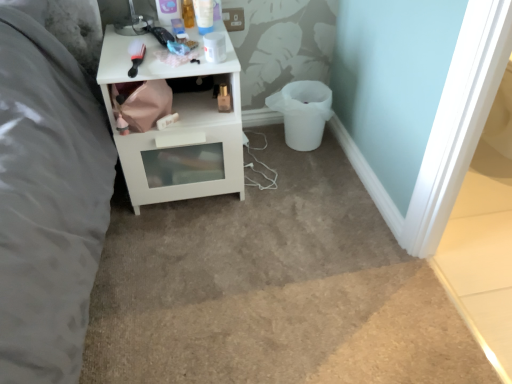
Question: Considering the relative sizes of white glossy nightstand at upper left and white plastic bucket at lower right in the image provided, is white glossy nightstand at upper left bigger than white plastic bucket at lower right?

Choices:
 (A) no
 (B) yes

Answer: (B)

Question: From a real-world perspective, is white glossy nightstand at upper left located beneath white plastic bucket at lower right?

Choices:
 (A) yes
 (B) no

Answer: (B)

Question: Is white glossy nightstand at upper left to the left of white plastic bucket at lower right from the viewer's perspective?

Choices:
 (A) no
 (B) yes

Answer: (B)

Question: Is white glossy nightstand at upper left oriented towards white plastic bucket at lower right?

Choices:
 (A) yes
 (B) no

Answer: (B)

Question: Could white plastic bucket at lower right be considered to be inside white glossy nightstand at upper left?

Choices:
 (A) yes
 (B) no

Answer: (B)

Question: Considering the relative sizes of white glossy nightstand at upper left and white plastic bucket at lower right in the image provided, is white glossy nightstand at upper left shorter than white plastic bucket at lower right?

Choices:
 (A) no
 (B) yes

Answer: (A)

Question: From the image's perspective, is white plastic bucket at lower right under white glossy nightstand at upper left?

Choices:
 (A) no
 (B) yes

Answer: (A)

Question: Is white plastic bucket at lower right wider than white glossy nightstand at upper left?

Choices:
 (A) no
 (B) yes

Answer: (A)

Question: Could you tell me if white plastic bucket at lower right is facing white glossy nightstand at upper left?

Choices:
 (A) no
 (B) yes

Answer: (A)

Question: From a real-world perspective, is white plastic bucket at lower right under white glossy nightstand at upper left?

Choices:
 (A) no
 (B) yes

Answer: (B)

Question: Is the surface of white plastic bucket at lower right in direct contact with white glossy nightstand at upper left?

Choices:
 (A) yes
 (B) no

Answer: (B)

Question: Is white glossy nightstand at upper left at the back of white plastic bucket at lower right?

Choices:
 (A) yes
 (B) no

Answer: (B)

Question: Is white glossy nightstand at upper left situated inside white plastic bucket at lower right or outside?

Choices:
 (A) outside
 (B) inside

Answer: (A)